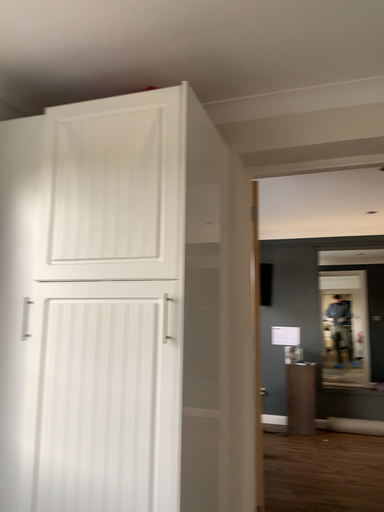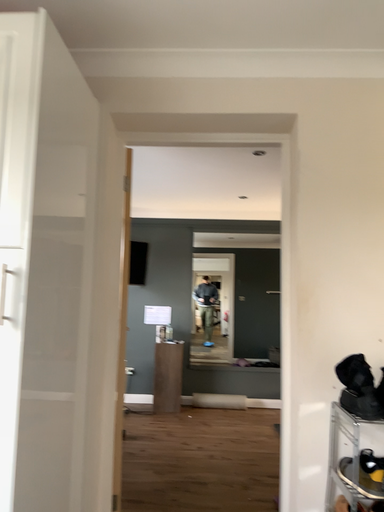
Question: How did the camera likely rotate when shooting the video?

Choices:
 (A) rotated left
 (B) rotated right

Answer: (B)